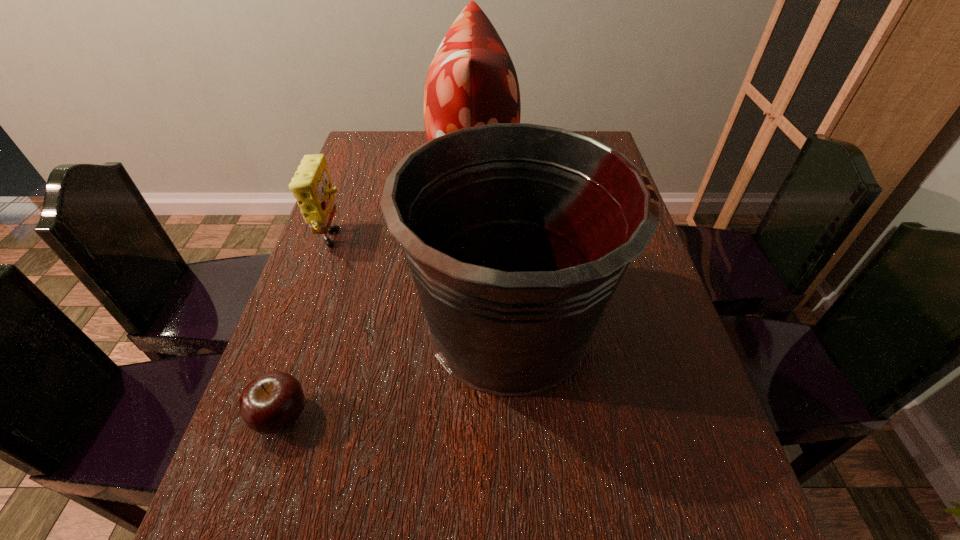
Locate an element on the screen. Image resolution: width=960 pixels, height=540 pixels. the farthest object is located at coordinates (471, 81).

Locate an element on the screen. bucket is located at coordinates (517, 235).

Identify the location of sponge. (311, 185).

The width and height of the screenshot is (960, 540). I want to click on apple, so click(x=271, y=403).

Where is `vacant space located 0.070m on the front-facing side of the farthest object`? The height and width of the screenshot is (540, 960). vacant space located 0.070m on the front-facing side of the farthest object is located at coordinates (539, 168).

What are the coordinates of `free point located on the front of the bucket` in the screenshot? It's located at point(516,458).

This screenshot has width=960, height=540. Identify the location of vacant area located on the face of the second shortest object. (407, 243).

What are the coordinates of `blank area located 0.130m on the right of the shortest object` in the screenshot? It's located at (381, 417).

Where is `object situated at the far edge`? object situated at the far edge is located at coordinates (471, 81).

The image size is (960, 540). I want to click on sponge that is at the left edge, so click(311, 185).